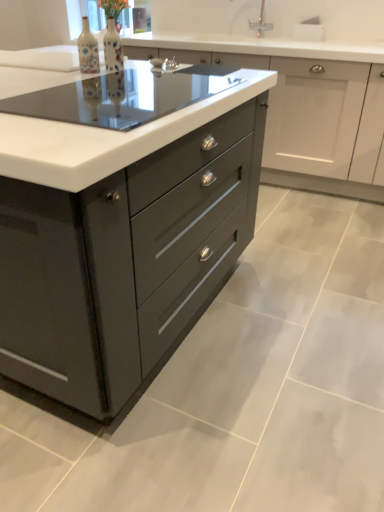
I want to click on matte black cooktop at center, so click(123, 96).

What do you see at coordinates (123, 96) in the screenshot? I see `matte black cooktop at center` at bounding box center [123, 96].

How much space does matte ceramic vase at upper center, acting as the 2th bottle starting from the left, occupy horizontally?

It is 3.01 inches.

Locate an element on the screen. The image size is (384, 512). glossy dark gray chest of drawers at center is located at coordinates (121, 244).

Find the location of a particular element. The height and width of the screenshot is (512, 384). cabinetry positioned vertically above the glossy dark gray chest of drawers at center (from a real-world perspective) is located at coordinates (305, 108).

Based on the photo, does glossy dark gray chest of drawers at center contain matte gray cabinet at center?

→ No, matte gray cabinet at center is not a part of glossy dark gray chest of drawers at center.

Is point (180, 313) positioned in front of point (351, 182)?

Yes, it is in front of point (351, 182).

Is the surface of matte black cooktop at center in direct contact with matte ceramic vase at upper center, the 1th bottle when ordered from right to left?

They are not placed beside each other.

Which object is thinner, matte black cooktop at center or matte ceramic vase at upper center, the 1th bottle when ordered from right to left?

With smaller width is matte ceramic vase at upper center, the 1th bottle when ordered from right to left.

Which object is further away from the camera taking this photo, matte black cooktop at center or matte ceramic vase at upper center, the 1th bottle when ordered from right to left?

matte ceramic vase at upper center, the 1th bottle when ordered from right to left.

I want to click on appliance below the matte ceramic vase at upper center, acting as the 2th bottle starting from the left (from a real-world perspective), so click(x=123, y=96).

Considering the positions of objects glossy dark gray chest of drawers at center and matte ceramic vase at upper center, the 1th bottle when ordered from right to left, in the image provided, who is more to the left, glossy dark gray chest of drawers at center or matte ceramic vase at upper center, the 1th bottle when ordered from right to left,?

From the viewer's perspective, glossy dark gray chest of drawers at center appears more on the left side.

Where is `bottle that is the 1st one above the glossy dark gray chest of drawers at center (from a real-world perspective)`? The image size is (384, 512). bottle that is the 1st one above the glossy dark gray chest of drawers at center (from a real-world perspective) is located at coordinates (113, 47).

Considering the positions of points (153, 179) and (121, 60), is point (153, 179) farther from camera compared to point (121, 60)?

No, (153, 179) is closer to viewer.

Looking at this image, which object is further away from the camera taking this photo, matte ceramic vase at upper center, acting as the 2th bottle starting from the left, or matte black cooktop at center?

Positioned behind is matte ceramic vase at upper center, acting as the 2th bottle starting from the left.

From the image's perspective, is matte ceramic vase at upper center, acting as the 2th bottle starting from the left, located above or below matte black cooktop at center?

From the image's perspective, matte ceramic vase at upper center, acting as the 2th bottle starting from the left, appears above matte black cooktop at center.

What's the angular difference between matte ceramic vase at upper center, the 1th bottle when ordered from right to left, and matte black cooktop at center's facing directions?

matte ceramic vase at upper center, the 1th bottle when ordered from right to left, and matte black cooktop at center are facing 179 degrees away from each other.

In the image, is matte ceramic vase at upper center, acting as the 2th bottle starting from the left, on the left side or the right side of matte black cooktop at center?

In the image, matte ceramic vase at upper center, acting as the 2th bottle starting from the left, appears on the left side of matte black cooktop at center.

Which is more to the left, matte gray cabinet at center or matte ceramic vase at upper center, the 1th bottle when ordered from right to left?

matte ceramic vase at upper center, the 1th bottle when ordered from right to left, is more to the left.

Is matte gray cabinet at center not close to matte ceramic vase at upper center, acting as the 2th bottle starting from the left?

That's right, there is a large distance between matte gray cabinet at center and matte ceramic vase at upper center, acting as the 2th bottle starting from the left.

In the image, is matte gray cabinet at center positioned in front of or behind matte ceramic vase at upper center, the 1th bottle when ordered from right to left?

Visually, matte gray cabinet at center is located behind matte ceramic vase at upper center, the 1th bottle when ordered from right to left.

Considering the sizes of objects matte gray cabinet at center and matte ceramic vase at upper center, acting as the 2th bottle starting from the left, in the image provided, who is shorter, matte gray cabinet at center or matte ceramic vase at upper center, acting as the 2th bottle starting from the left,?

Standing shorter between the two is matte ceramic vase at upper center, acting as the 2th bottle starting from the left.

Is matte gray cabinet at center surrounded by matte black cooktop at center?

No, matte black cooktop at center does not contain matte gray cabinet at center.

Considering the relative sizes of matte black cooktop at center and matte gray cabinet at center in the image provided, is matte black cooktop at center shorter than matte gray cabinet at center?

Yes.

Who is taller, matte gray cabinet at center or glossy dark gray chest of drawers at center?

With more height is glossy dark gray chest of drawers at center.

Is matte gray cabinet at center bigger or smaller than glossy dark gray chest of drawers at center?

matte gray cabinet at center is smaller than glossy dark gray chest of drawers at center.

Is matte gray cabinet at center thinner than glossy dark gray chest of drawers at center?

Correct, the width of matte gray cabinet at center is less than that of glossy dark gray chest of drawers at center.

Does matte gray cabinet at center contain glossy dark gray chest of drawers at center?

No, glossy dark gray chest of drawers at center is not surrounded by matte gray cabinet at center.

Where is `the chest of drawers directly beneath the matte gray cabinet at center (from a real-world perspective)`? Image resolution: width=384 pixels, height=512 pixels. the chest of drawers directly beneath the matte gray cabinet at center (from a real-world perspective) is located at coordinates (121, 244).

Where is `bottle that is the 2nd object located above the matte black cooktop at center (from the image's perspective)`? Image resolution: width=384 pixels, height=512 pixels. bottle that is the 2nd object located above the matte black cooktop at center (from the image's perspective) is located at coordinates (113, 47).

Which object lies further to the anchor point matte black cooktop at center, glossy dark gray chest of drawers at center or matte gray cabinet at center?

Among the two, matte gray cabinet at center is located further to matte black cooktop at center.

Considering their positions, is matte ceramic bottle at upper left, the second bottle from the right, positioned closer to matte black cooktop at center than glossy dark gray chest of drawers at center?

matte ceramic bottle at upper left, the second bottle from the right, lies closer to matte black cooktop at center than the other object.

Looking at the image, which one is located closer to matte ceramic vase at upper center, the 1th bottle when ordered from right to left, glossy dark gray chest of drawers at center or matte black cooktop at center?

The object closer to matte ceramic vase at upper center, the 1th bottle when ordered from right to left, is matte black cooktop at center.

From the image, which object appears to be farther from matte ceramic bottle at upper left, the first bottle viewed from the left, glossy dark gray chest of drawers at center or matte ceramic vase at upper center, the 1th bottle when ordered from right to left?

Among the two, glossy dark gray chest of drawers at center is located further to matte ceramic bottle at upper left, the first bottle viewed from the left.

Based on their spatial positions, is matte gray cabinet at center or matte black cooktop at center closer to glossy dark gray chest of drawers at center?

matte black cooktop at center lies closer to glossy dark gray chest of drawers at center than the other object.

From the image, which object appears to be farther from matte black cooktop at center, glossy dark gray chest of drawers at center or matte ceramic vase at upper center, acting as the 2th bottle starting from the left?

glossy dark gray chest of drawers at center is positioned further to the anchor matte black cooktop at center.

Considering their positions, is matte ceramic bottle at upper left, the second bottle from the right, positioned closer to matte ceramic vase at upper center, the 1th bottle when ordered from right to left, than glossy dark gray chest of drawers at center?

matte ceramic bottle at upper left, the second bottle from the right.

Based on the photo, looking at the image, which one is located further to matte gray cabinet at center, matte ceramic bottle at upper left, the second bottle from the right, or matte black cooktop at center?

matte ceramic bottle at upper left, the second bottle from the right, is further to matte gray cabinet at center.

The height and width of the screenshot is (512, 384). I want to click on bottle between glossy dark gray chest of drawers at center and matte ceramic vase at upper center, the 1th bottle when ordered from right to left, in the front-back direction, so click(x=88, y=49).

What are the coordinates of `appliance located between glossy dark gray chest of drawers at center and matte gray cabinet at center in the depth direction` in the screenshot? It's located at (123, 96).

Find the location of a particular element. This screenshot has height=512, width=384. appliance positioned between glossy dark gray chest of drawers at center and matte ceramic bottle at upper left, the first bottle viewed from the left, from near to far is located at coordinates (123, 96).

Image resolution: width=384 pixels, height=512 pixels. I want to click on bottle situated between matte ceramic bottle at upper left, the second bottle from the right, and matte gray cabinet at center from left to right, so click(x=113, y=47).